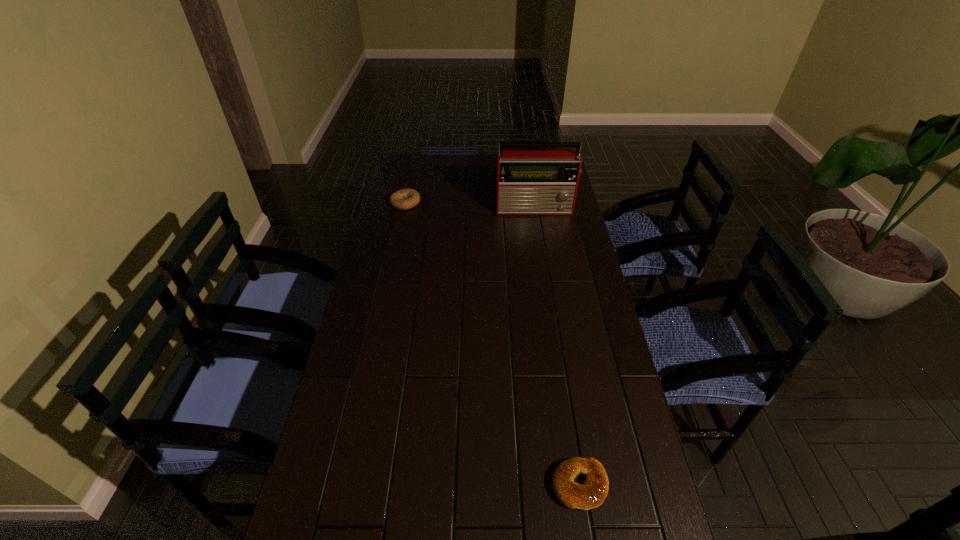
I want to click on the tallest object, so click(533, 178).

Locate an element on the screen. Image resolution: width=960 pixels, height=540 pixels. the left bagel is located at coordinates (403, 199).

Where is `the farther bagel`? the farther bagel is located at coordinates (403, 199).

Where is `the nearer bagel`? the nearer bagel is located at coordinates (591, 494).

Identify the location of the nearest object. (591, 494).

I want to click on free space located on the front-facing side of the tallest object, so point(547,276).

You are a GUI agent. You are given a task and a screenshot of the screen. Output one action in this format:
    pyautogui.click(x=<x>, y=<y>)
    Task: Click on the vacant space located 0.160m on the front of the farther bagel
    This screenshot has width=960, height=540.
    Given the screenshot: What is the action you would take?
    pyautogui.click(x=398, y=235)

In order to click on free space located 0.070m on the left of the nearer bagel in this screenshot , I will do `click(521, 485)`.

Locate an element on the screen. The height and width of the screenshot is (540, 960). object present at the left edge is located at coordinates click(x=403, y=199).

Where is `radio receiver positioned at the right edge`? Image resolution: width=960 pixels, height=540 pixels. radio receiver positioned at the right edge is located at coordinates (533, 178).